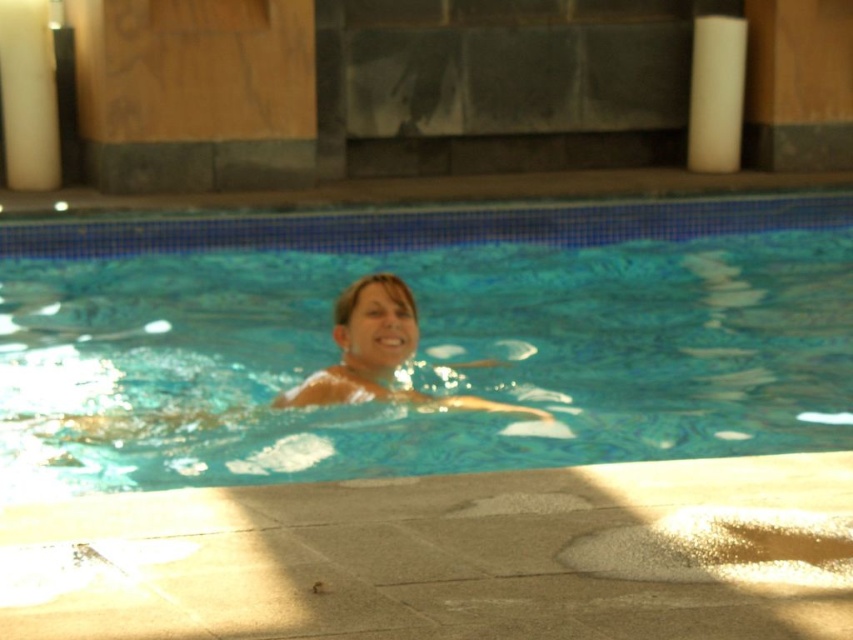
Question: Can you confirm if clear blue water at center is smaller than smooth skin at center?

Choices:
 (A) no
 (B) yes

Answer: (A)

Question: Which of the following is the closest to the observer?

Choices:
 (A) (339, 227)
 (B) (352, 371)

Answer: (B)

Question: Among these objects, which one is farthest from the camera?

Choices:
 (A) smooth skin at center
 (B) clear blue water at center

Answer: (A)

Question: Observing the image, what is the correct spatial positioning of clear blue water at center in reference to smooth skin at center?

Choices:
 (A) left
 (B) right

Answer: (B)

Question: Is clear blue water at center to the left of smooth skin at center from the viewer's perspective?

Choices:
 (A) no
 (B) yes

Answer: (A)